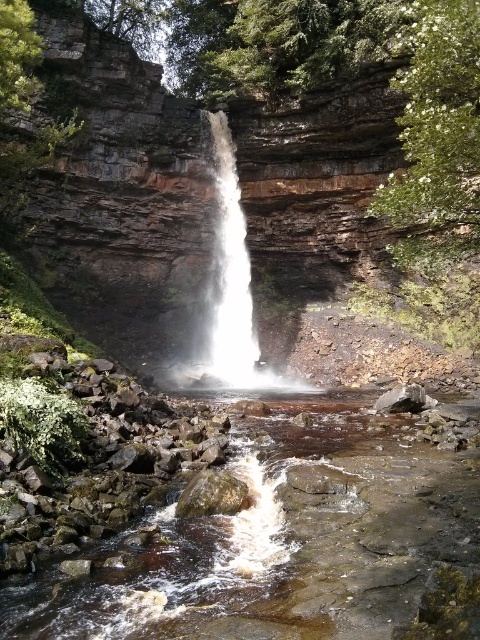
Question: Where is brown rocky stream at center located in relation to white frothy water at center in the image?

Choices:
 (A) above
 (B) below

Answer: (B)

Question: Which of the following is the closest to the observer?

Choices:
 (A) brown rocky stream at center
 (B) white frothy water at center

Answer: (A)

Question: From the image, what is the correct spatial relationship of brown rocky stream at center in relation to white frothy water at center?

Choices:
 (A) below
 (B) above

Answer: (A)

Question: Which point is farther to the camera?

Choices:
 (A) white frothy water at center
 (B) brown rocky stream at center

Answer: (A)

Question: Is brown rocky stream at center to the left of white frothy water at center from the viewer's perspective?

Choices:
 (A) no
 (B) yes

Answer: (A)